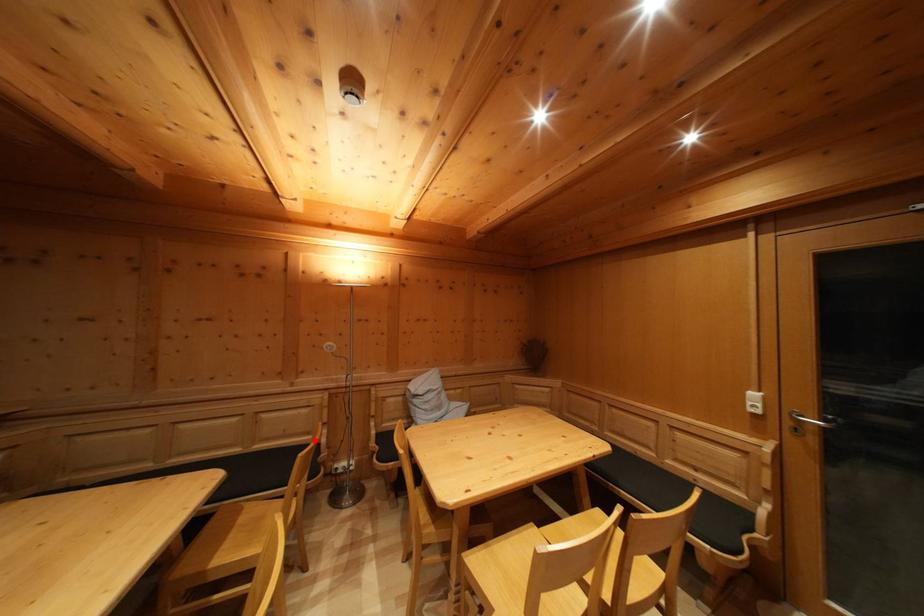
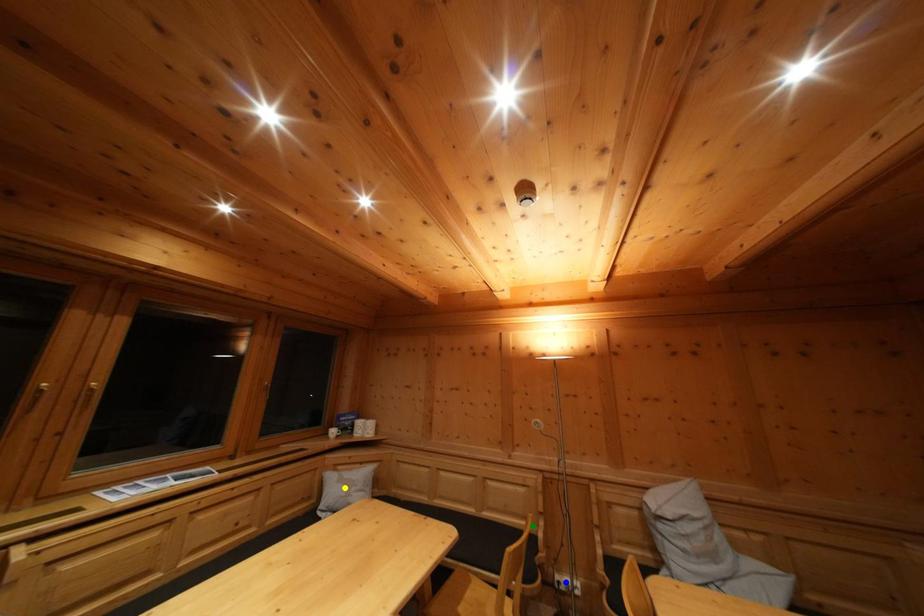
Question: I am providing you with two images of the same scene from different viewpoints. A red point is marked on the first image. You are given multiple points on the second image. Can you choose the point in image 2 that corresponds to the point in image 1?

Choices:
 (A) green point
 (B) yellow point
 (C) blue point

Answer: (A)